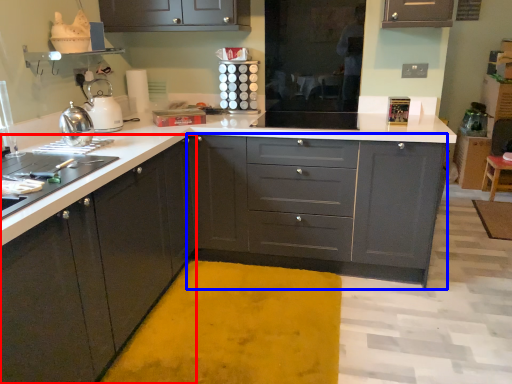
Question: Among these objects, which one is farthest to the camera, cabinetry (highlighted by a red box) or cabinetry (highlighted by a blue box)?

Choices:
 (A) cabinetry
 (B) cabinetry

Answer: (B)